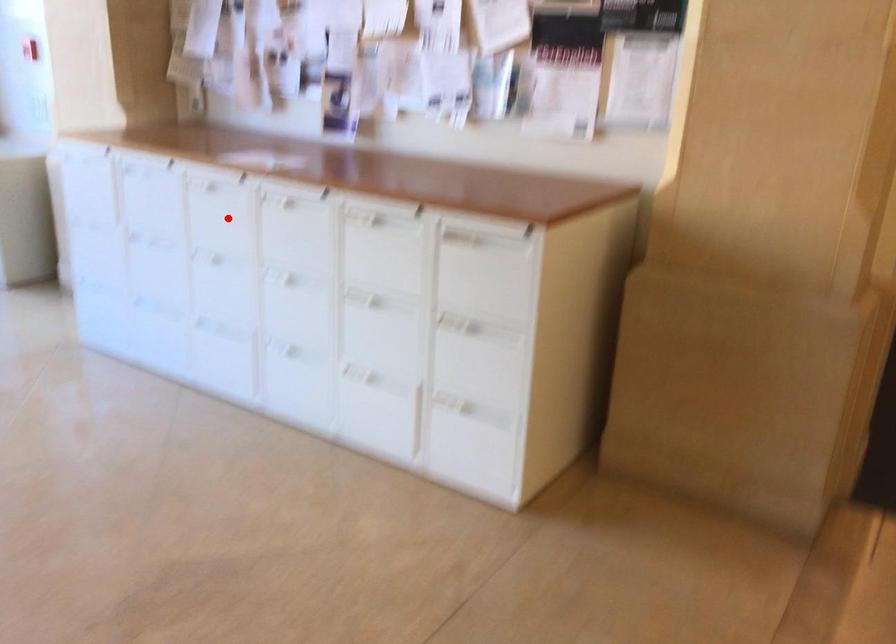
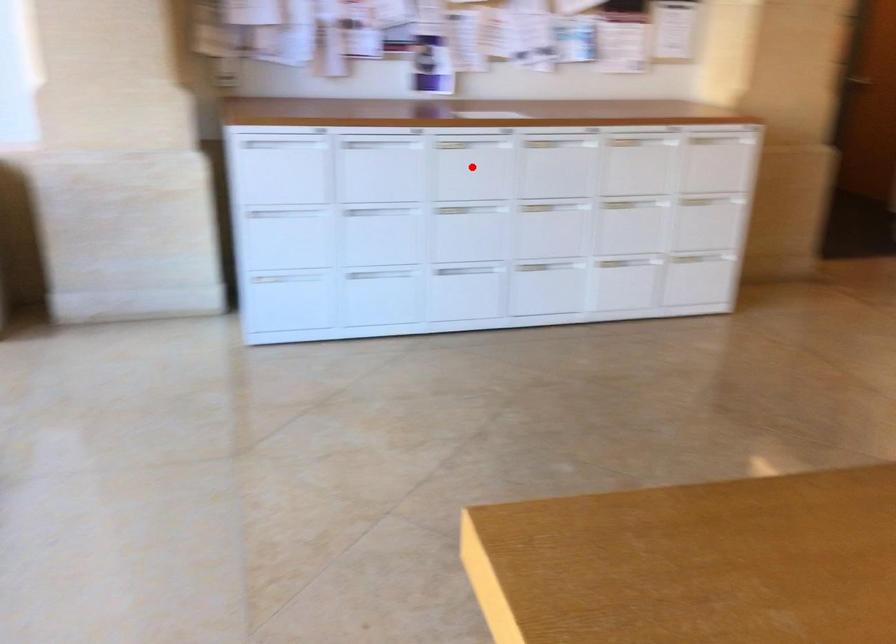
I am providing you with two images of the same scene from different viewpoints. A red point is marked on the first image and another point is marked on the second image. Does the point marked in image1 correspond to the same location as the one in image2?

Yes